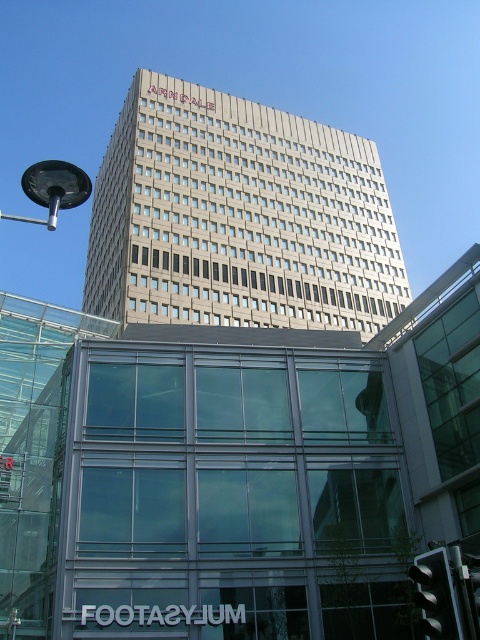
Is point (184, 132) positioned behind point (72, 198)?

Yes, it is behind point (72, 198).

Is beige concrete building at upper center smaller than black metallic streetlight at upper left?

Yes.

Which is behind, point (363, 262) or point (68, 172)?

Point (363, 262)

Where is `beige concrete building at upper center`? The height and width of the screenshot is (640, 480). beige concrete building at upper center is located at coordinates coord(239,218).